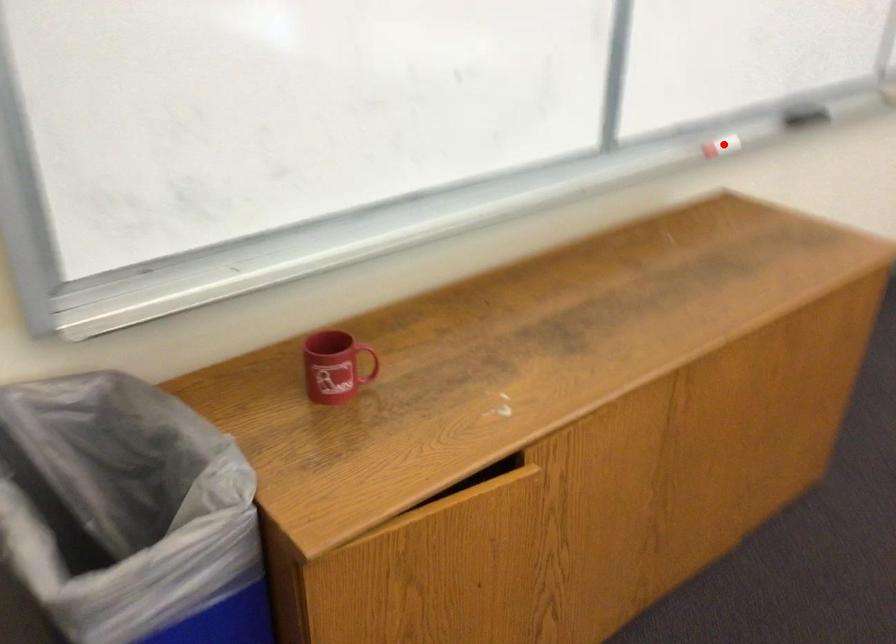
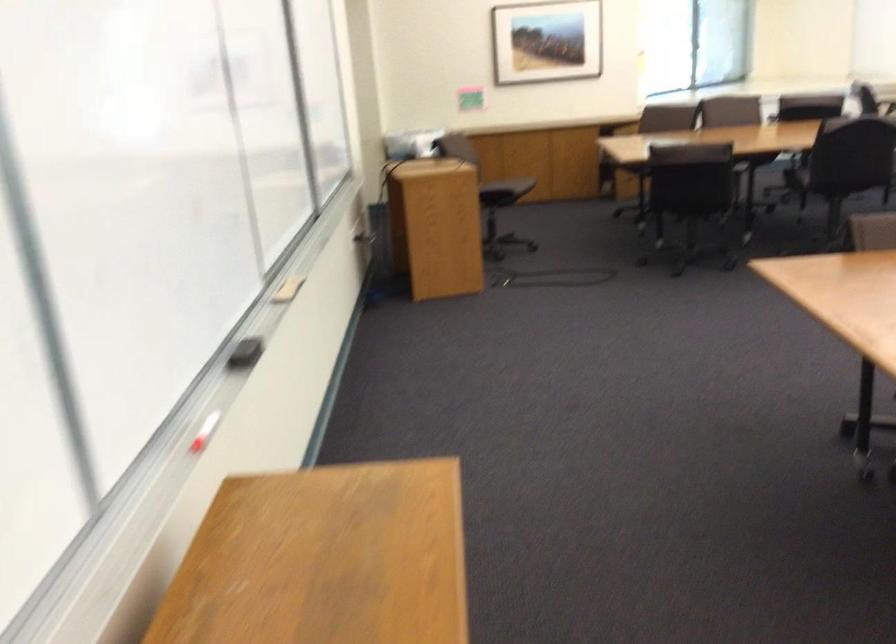
Question: I am providing you with two images of the same scene from different viewpoints. A red point is marked on the first image. Can you still see the location of the red point in image 2?

Choices:
 (A) Yes
 (B) No

Answer: (A)